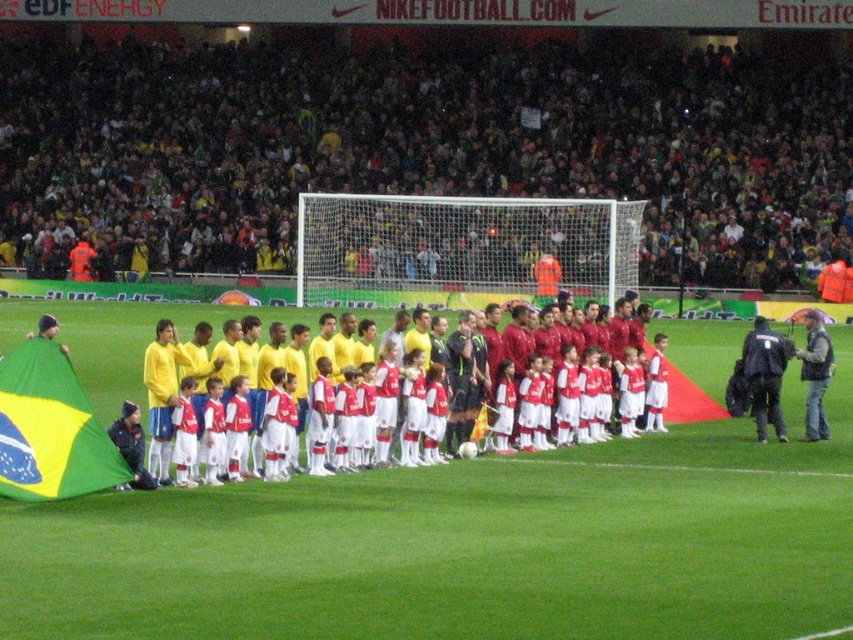
Question: Is green grass football field at center smaller than matte red soccer uniforms at center?

Choices:
 (A) no
 (B) yes

Answer: (A)

Question: Which object is closer to the camera taking this photo?

Choices:
 (A) green grass football field at center
 (B) matte red soccer uniforms at center
 (C) yellow-green fabric flag at left

Answer: (A)

Question: Among these objects, which one is nearest to the camera?

Choices:
 (A) yellow-green fabric flag at left
 (B) green grass football field at center
 (C) matte red soccer uniforms at center

Answer: (B)

Question: Does green grass football field at center have a smaller size compared to yellow-green fabric flag at left?

Choices:
 (A) no
 (B) yes

Answer: (A)

Question: Is green grass football field at center to the left of matte red soccer uniforms at center from the viewer's perspective?

Choices:
 (A) yes
 (B) no

Answer: (B)

Question: Based on their relative distances, which object is nearer to the yellow-green fabric flag at left?

Choices:
 (A) green grass football field at center
 (B) matte red soccer uniforms at center

Answer: (B)